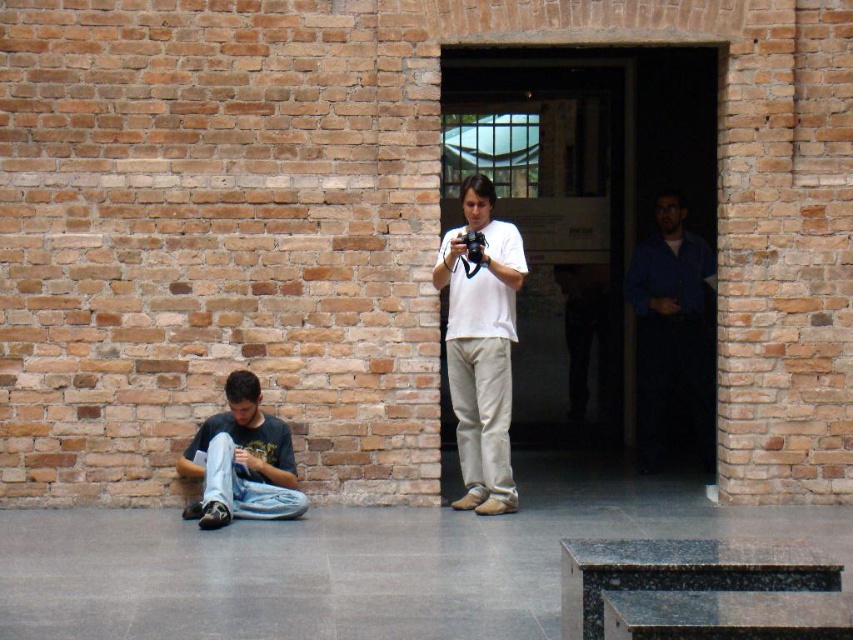
Question: Does dark blue shirt at right appear under denim jeans at lower left?

Choices:
 (A) no
 (B) yes

Answer: (A)

Question: Which point appears closest to the camera in this image?

Choices:
 (A) (251, 428)
 (B) (444, 243)
 (C) (665, 220)

Answer: (A)

Question: Which of the following is the closest to the observer?

Choices:
 (A) (670, 300)
 (B) (210, 448)
 (C) (467, 483)

Answer: (B)

Question: Does white matte shirt at center appear over denim jeans at lower left?

Choices:
 (A) yes
 (B) no

Answer: (A)

Question: Which object appears farthest from the camera in this image?

Choices:
 (A) dark blue shirt at right
 (B) white matte shirt at center
 (C) denim jeans at lower left

Answer: (A)

Question: Does white matte shirt at center have a greater width compared to denim jeans at lower left?

Choices:
 (A) no
 (B) yes

Answer: (A)